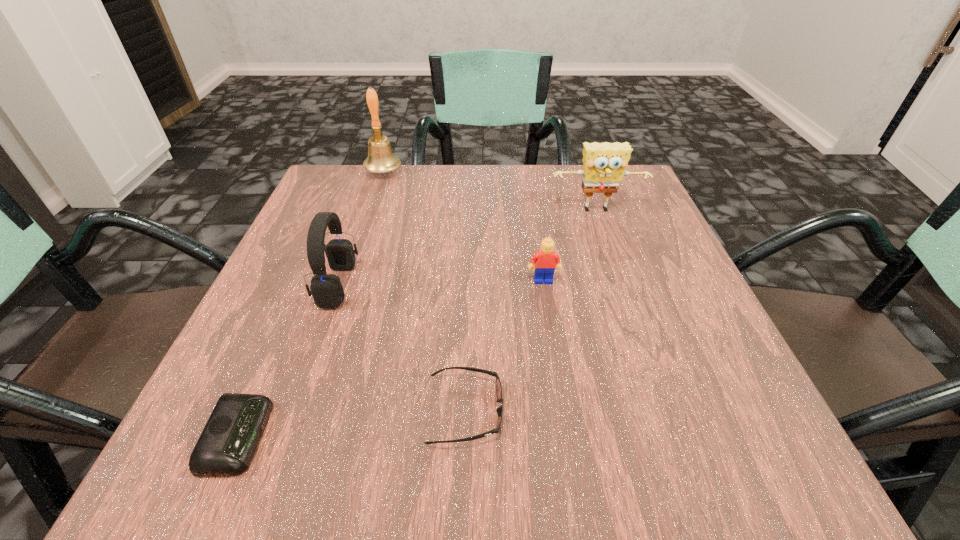
I want to click on vacant space at the near left corner, so click(x=247, y=483).

The width and height of the screenshot is (960, 540). Find the location of `vacant space at the far right corner of the desktop`. vacant space at the far right corner of the desktop is located at coordinates (648, 194).

The image size is (960, 540). I want to click on free space between the tallest object and the alarm clock, so click(311, 305).

This screenshot has height=540, width=960. Find the location of `blank region between the alarm clock and the tallest object`. blank region between the alarm clock and the tallest object is located at coordinates (311, 305).

You are a GUI agent. You are given a task and a screenshot of the screen. Output one action in this format:
    pyautogui.click(x=<x>, y=<y>)
    Task: Click on the vacant space that's between the fourth object from left to right and the Lego
    This screenshot has height=540, width=960.
    Given the screenshot: What is the action you would take?
    pyautogui.click(x=504, y=346)

Locate an element on the screen. This screenshot has width=960, height=540. free space between the sponge and the alarm clock is located at coordinates (418, 324).

I want to click on vacant space that is in between the farthest object and the Lego, so click(464, 226).

The width and height of the screenshot is (960, 540). I want to click on empty location between the second farthest object and the second object from right to left, so click(x=570, y=246).

This screenshot has height=540, width=960. Identify the location of free spot between the bell and the Lego. (464, 226).

Image resolution: width=960 pixels, height=540 pixels. Identify the location of vacant space that is in between the headset and the third object from right to left. (401, 348).